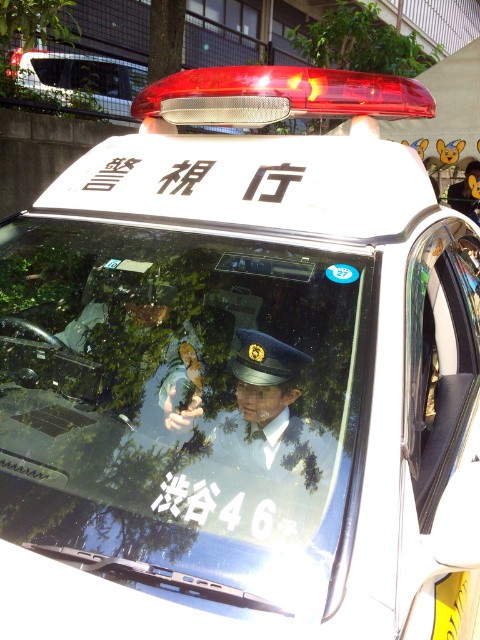
Is uniformed officer at center in front of matte black uniform at center?

Yes.

How far apart are uniformed officer at center and matte black uniform at center?

The distance of uniformed officer at center from matte black uniform at center is 6.74 inches.

What do you see at coordinates (271, 416) in the screenshot? I see `uniformed officer at center` at bounding box center [271, 416].

The width and height of the screenshot is (480, 640). Identify the location of uniformed officer at center. (271, 416).

Between point (94, 93) and point (169, 413), which one is positioned in front?

Positioned in front is point (169, 413).

Is white glossy sedan at upper left further to the viewer compared to matte black uniform at center?

Yes.

The width and height of the screenshot is (480, 640). What are the coordinates of `white glossy sedan at upper left` in the screenshot? It's located at [81, 77].

Can you confirm if uniformed officer at center is bigger than white glossy sedan at upper left?

Actually, uniformed officer at center might be smaller than white glossy sedan at upper left.

Does uniformed officer at center have a lesser height compared to white glossy sedan at upper left?

Correct, uniformed officer at center is not as tall as white glossy sedan at upper left.

Which is behind, point (228, 433) or point (12, 54)?

Positioned behind is point (12, 54).

You are a GUI agent. You are given a task and a screenshot of the screen. Output one action in this format:
    pyautogui.click(x=<x>, y=<y>)
    Task: Click on the uniformed officer at center
    
    Given the screenshot: What is the action you would take?
    pyautogui.click(x=271, y=416)